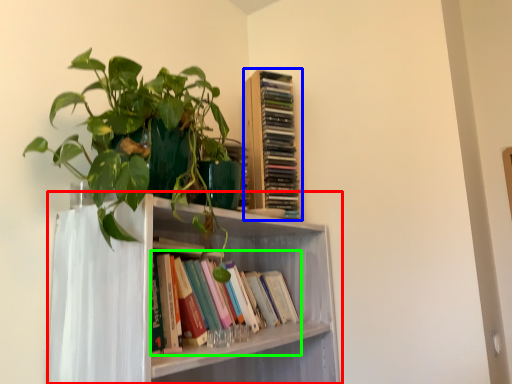
Question: Which object is the closest to the shelf (highlighted by a red box)? Choose among these: book (highlighted by a blue box) or book (highlighted by a green box).

Choices:
 (A) book
 (B) book

Answer: (B)